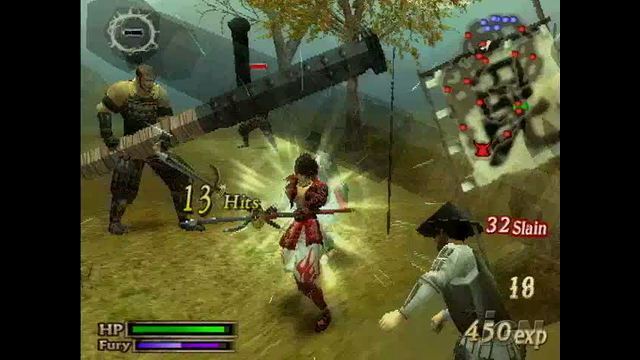
Identify the location of wall. Image resolution: width=640 pixels, height=360 pixels. (419, 151).